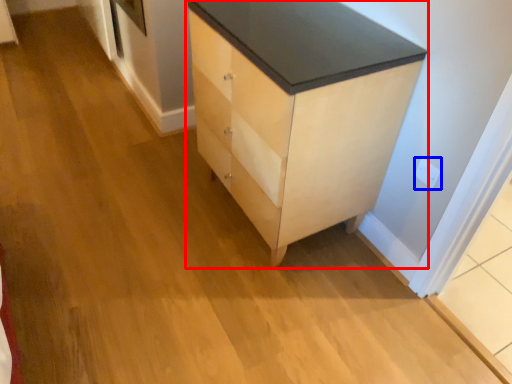
Question: Which object appears farthest to the camera in this image, chest of drawers (highlighted by a red box) or electric outlet (highlighted by a blue box)?

Choices:
 (A) chest of drawers
 (B) electric outlet

Answer: (B)